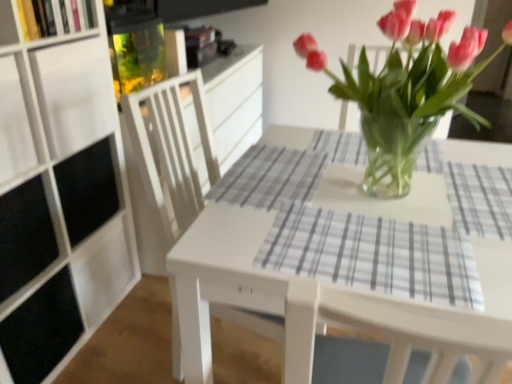
Describe the element at coordinates (373, 255) in the screenshot. I see `gray plaid placemat at center` at that location.

This screenshot has width=512, height=384. Describe the element at coordinates (59, 192) in the screenshot. I see `white matte cabinet at left` at that location.

What is the approximate width of pink glass vase at center?

The width of pink glass vase at center is 16.96 inches.

Where is `white glossy table at center`? This screenshot has height=384, width=512. white glossy table at center is located at coordinates pos(327,303).

The height and width of the screenshot is (384, 512). What do you see at coordinates (327, 303) in the screenshot?
I see `white glossy table at center` at bounding box center [327, 303].

This screenshot has width=512, height=384. In order to click on gray plaid placemat at center in this screenshot , I will do `click(373, 255)`.

Between white wood chair at center and pink glass vase at center, which one appears on the left side from the viewer's perspective?

Positioned to the left is white wood chair at center.

Between white wood chair at center and pink glass vase at center, which one has smaller width?

With smaller width is pink glass vase at center.

From the image's perspective, which is above, white wood chair at center or pink glass vase at center?

pink glass vase at center, from the image's perspective.

Is white matte cabinet at left behind white matte shelf at upper left, which is counted as the 2th shelf, starting from the top?

No, white matte cabinet at left is in front of white matte shelf at upper left, which is counted as the 2th shelf, starting from the top.

In the scene shown: Is white matte cabinet at left far from white matte shelf at upper left, which is counted as the 2th shelf, starting from the top?

Actually, white matte cabinet at left and white matte shelf at upper left, which is counted as the 2th shelf, starting from the top, are a little close together.

Is white matte shelf at upper left, which is counted as the 2th shelf, starting from the top, located within white matte cabinet at left?

Yes, white matte shelf at upper left, which is counted as the 2th shelf, starting from the top, can be found within white matte cabinet at left.

At what (x,y) coordinates should I click in order to perform the action: click on the 1st shelf to the right of the white matte cabinet at left, starting your count from the anchor. Please return your answer as a coordinate pair (x, y). Image resolution: width=512 pixels, height=384 pixels. Looking at the image, I should click on (74, 94).

Where is `shelf on the right of white matte shelf at upper left, which is counted as the 1th shelf, starting from the bottom`? shelf on the right of white matte shelf at upper left, which is counted as the 1th shelf, starting from the bottom is located at coordinates pyautogui.click(x=54, y=17).

Consider the image. Is wooden bookshelf at upper left, marked as the first shelf in a top-to-bottom arrangement, further to camera compared to white matte shelf at upper left, which is counted as the 2th shelf, starting from the top?

No, wooden bookshelf at upper left, marked as the first shelf in a top-to-bottom arrangement, is closer to the camera.

From the picture: Which object is thinner, wooden bookshelf at upper left, marked as the first shelf in a top-to-bottom arrangement, or white matte shelf at upper left, which is counted as the 1th shelf, starting from the bottom?

wooden bookshelf at upper left, marked as the first shelf in a top-to-bottom arrangement.

Is white glossy table at center inside or outside of gray plaid placemat at center?

white glossy table at center is located beyond the bounds of gray plaid placemat at center.

Which point is more distant from viewer, [488,378] or [374,271]?

The point [374,271] is farther.

Which of these two, white glossy table at center or gray plaid placemat at center, is wider?

With larger width is white glossy table at center.

Is white matte shelf at upper left, which is counted as the 1th shelf, starting from the bottom, shorter than pink glass vase at center?

Yes.

Where is `houseplant that appears in front of the white matte shelf at upper left, which is counted as the 1th shelf, starting from the bottom`? The width and height of the screenshot is (512, 384). houseplant that appears in front of the white matte shelf at upper left, which is counted as the 1th shelf, starting from the bottom is located at coordinates (406, 90).

Is white matte shelf at upper left, which is counted as the 1th shelf, starting from the bottom, positioned beyond the bounds of pink glass vase at center?

Indeed, white matte shelf at upper left, which is counted as the 1th shelf, starting from the bottom, is completely outside pink glass vase at center.

Is pink glass vase at center closer to camera compared to wooden bookshelf at upper left, marked as the first shelf in a top-to-bottom arrangement?

Yes, the depth of pink glass vase at center is less than that of wooden bookshelf at upper left, marked as the first shelf in a top-to-bottom arrangement.

From the image's perspective, is pink glass vase at center below wooden bookshelf at upper left, marked as the first shelf in a top-to-bottom arrangement?

Correct, pink glass vase at center appears lower than wooden bookshelf at upper left, marked as the first shelf in a top-to-bottom arrangement, in the image.

From a real-world perspective, who is located higher, pink glass vase at center or wooden bookshelf at upper left, the 2th shelf positioned from the bottom?

wooden bookshelf at upper left, the 2th shelf positioned from the bottom, from a real-world perspective.

Based on their sizes in the image, would you say pink glass vase at center is bigger or smaller than wooden bookshelf at upper left, marked as the first shelf in a top-to-bottom arrangement?

Considering their sizes, pink glass vase at center takes up more space than wooden bookshelf at upper left, marked as the first shelf in a top-to-bottom arrangement.

Is wooden bookshelf at upper left, the 2th shelf positioned from the bottom, in contact with pink glass vase at center?

There is a gap between wooden bookshelf at upper left, the 2th shelf positioned from the bottom, and pink glass vase at center.

Is wooden bookshelf at upper left, marked as the first shelf in a top-to-bottom arrangement, closer to the viewer compared to pink glass vase at center?

That is False.

Is pink glass vase at center surrounded by wooden bookshelf at upper left, marked as the first shelf in a top-to-bottom arrangement?

No, pink glass vase at center is not inside wooden bookshelf at upper left, marked as the first shelf in a top-to-bottom arrangement.

Does wooden bookshelf at upper left, the 2th shelf positioned from the bottom, appear on the right side of pink glass vase at center?

Incorrect, wooden bookshelf at upper left, the 2th shelf positioned from the bottom, is not on the right side of pink glass vase at center.

This screenshot has height=384, width=512. In order to click on armchair that is on the left side of pink glass vase at center in this screenshot , I will do `click(170, 153)`.

Find the location of a particular element. The height and width of the screenshot is (384, 512). cabinetry below the white matte shelf at upper left, which is counted as the 2th shelf, starting from the top (from the image's perspective) is located at coordinates (59, 192).

Based on their spatial positions, is white glossy table at center or white wood chair at center closer to gray plaid placemat at center?

Based on the image, white glossy table at center appears to be nearer to gray plaid placemat at center.

Considering their positions, is gray plaid placemat at center positioned closer to white matte cabinet at left than white glossy table at center?

white glossy table at center.

Considering their positions, is white wood chair at center positioned closer to white glossy table at center than gray plaid placemat at center?

The object closer to white glossy table at center is gray plaid placemat at center.

Which object lies further to the anchor point gray plaid placemat at center, pink glass vase at center or white glossy table at center?

pink glass vase at center lies further to gray plaid placemat at center than the other object.

When comparing their distances from white matte shelf at upper left, which is counted as the 2th shelf, starting from the top, does gray plaid placemat at center or wooden bookshelf at upper left, the 2th shelf positioned from the bottom, seem further?

Among the two, gray plaid placemat at center is located further to white matte shelf at upper left, which is counted as the 2th shelf, starting from the top.

Looking at the image, which one is located closer to white matte cabinet at left, wooden bookshelf at upper left, marked as the first shelf in a top-to-bottom arrangement, or white wood chair at center?

wooden bookshelf at upper left, marked as the first shelf in a top-to-bottom arrangement, is closer to white matte cabinet at left.

Which object lies further to the anchor point white matte shelf at upper left, which is counted as the 2th shelf, starting from the top, white glossy table at center or white wood chair at center?

white glossy table at center is positioned further to the anchor white matte shelf at upper left, which is counted as the 2th shelf, starting from the top.

When comparing their distances from wooden bookshelf at upper left, marked as the first shelf in a top-to-bottom arrangement, does white matte shelf at upper left, which is counted as the 1th shelf, starting from the bottom, or white glossy table at center seem further?

white glossy table at center is further to wooden bookshelf at upper left, marked as the first shelf in a top-to-bottom arrangement.

The width and height of the screenshot is (512, 384). Identify the location of shelf located between white matte shelf at upper left, which is counted as the 2th shelf, starting from the top, and gray plaid placemat at center in the left-right direction. (54, 17).

Where is `flannel between pink glass vase at center and white glossy table at center from top to bottom`? The height and width of the screenshot is (384, 512). flannel between pink glass vase at center and white glossy table at center from top to bottom is located at coordinates [373, 255].

The height and width of the screenshot is (384, 512). I want to click on houseplant between white matte cabinet at left and white glossy table at center from left to right, so click(406, 90).

Image resolution: width=512 pixels, height=384 pixels. I want to click on armchair between white matte cabinet at left and white glossy table at center, so tap(170, 153).